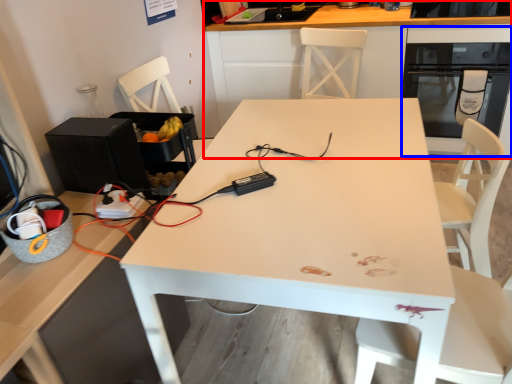
Question: Among these objects, which one is nearest to the camera, cabinetry (highlighted by a red box) or oven (highlighted by a blue box)?

Choices:
 (A) cabinetry
 (B) oven

Answer: (A)